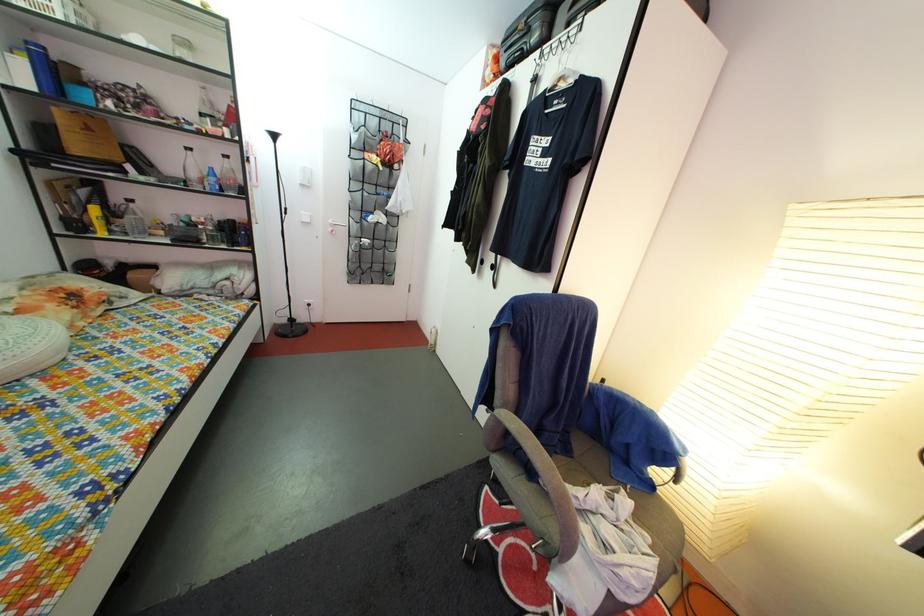
Locate an element on the screen. The image size is (924, 616). silver door handle is located at coordinates (334, 225).